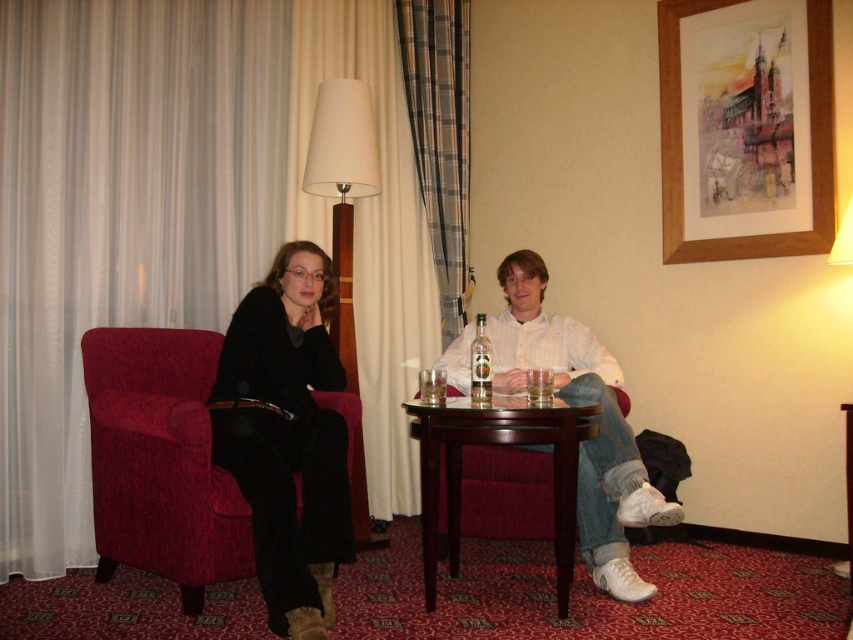
Which is more to the right, white sheer curtain at left or translucent glass at table center?

From the viewer's perspective, translucent glass at table center appears more on the right side.

Who is more forward, (238,282) or (436,401)?

Point (436,401) is more forward.

Where is `white sheer curtain at left`? white sheer curtain at left is located at coordinates (180, 218).

Between white sheer curtain at left and matte black jacket at center, which one appears on the right side from the viewer's perspective?

matte black jacket at center

Is white sheer curtain at left to the right of matte black jacket at center from the viewer's perspective?

Incorrect, white sheer curtain at left is not on the right side of matte black jacket at center.

Who is more forward, (128, 268) or (265, 500)?

Point (265, 500)

The image size is (853, 640). In order to click on white sheer curtain at left in this screenshot , I will do `click(180, 218)`.

Where is `plaid fabric curtain at center`? The width and height of the screenshot is (853, 640). plaid fabric curtain at center is located at coordinates (440, 136).

The image size is (853, 640). I want to click on plaid fabric curtain at center, so click(440, 136).